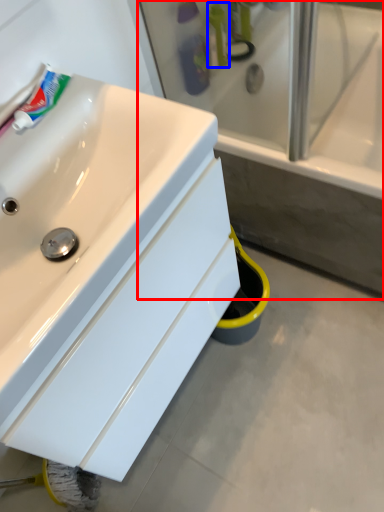
Question: Among these objects, which one is nearest to the camera, bathtub (highlighted by a red box) or mouthwash (highlighted by a blue box)?

Choices:
 (A) bathtub
 (B) mouthwash

Answer: (A)